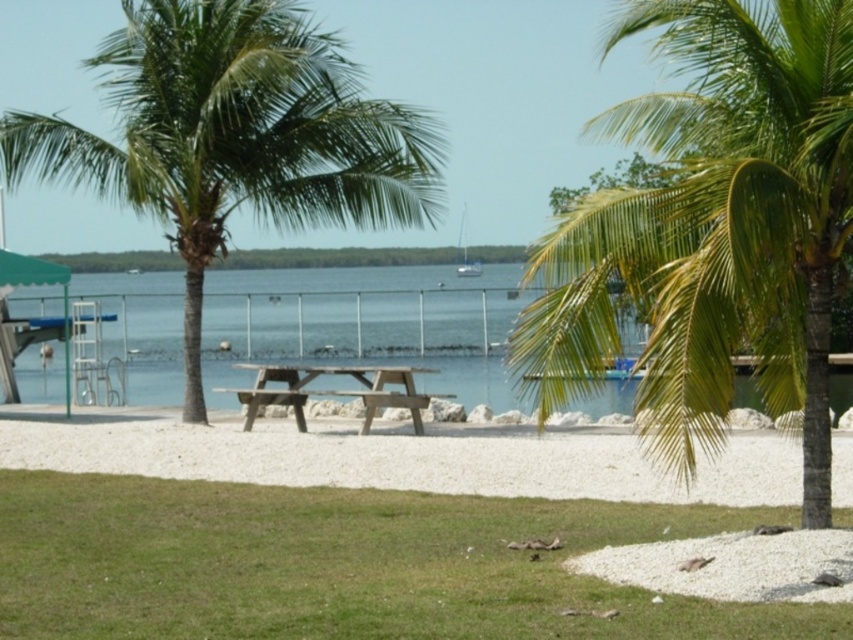
Can you confirm if green leafy palm tree at upper right is taller than clear blue water at center?

Indeed, green leafy palm tree at upper right has a greater height compared to clear blue water at center.

Between green leafy palm tree at upper right and clear blue water at center, which one appears on the left side from the viewer's perspective?

clear blue water at center

Describe the element at coordinates (712, 228) in the screenshot. This screenshot has height=640, width=853. I see `green leafy palm tree at upper right` at that location.

In order to click on green leafy palm tree at upper right in this screenshot , I will do pos(712,228).

Is point (80, 452) behind point (462, 262)?

No, it is not.

Is point (296, 484) closer to camera compared to point (462, 221)?

Yes, point (296, 484) is in front of point (462, 221).

Does point (277, 461) come in front of point (479, 260)?

That is True.

Find the location of a particular element. The width and height of the screenshot is (853, 640). white gravel at center is located at coordinates (397, 458).

Which is more to the left, clear blue water at center or brown wooden picnic table at center?

clear blue water at center

Does clear blue water at center have a smaller size compared to brown wooden picnic table at center?

No, clear blue water at center is not smaller than brown wooden picnic table at center.

Locate an element on the screen. clear blue water at center is located at coordinates (367, 324).